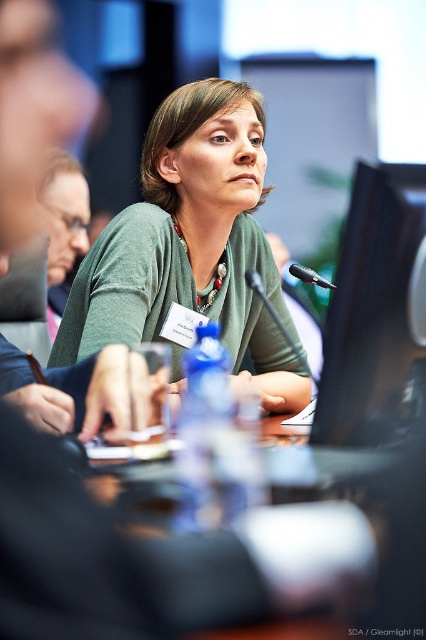
Question: Can you confirm if black glossy monitor at center is thinner than transparent glass table at center?

Choices:
 (A) yes
 (B) no

Answer: (A)

Question: Is green matte cardigan at center closer to the viewer compared to black glossy monitor at center?

Choices:
 (A) yes
 (B) no

Answer: (B)

Question: Considering the relative positions of green matte cardigan at center and transparent glass table at center in the image provided, where is green matte cardigan at center located with respect to transparent glass table at center?

Choices:
 (A) right
 (B) left

Answer: (B)

Question: Which point is closer to the camera taking this photo?

Choices:
 (A) (175, 280)
 (B) (388, 513)
 (C) (299, 273)

Answer: (B)

Question: Which point is farther from the camera taking this photo?

Choices:
 (A) (296, 275)
 (B) (351, 243)
 (C) (161, 323)

Answer: (C)

Question: Considering the real-world distances, which object is farthest from the black glossy monitor at center?

Choices:
 (A) green matte cardigan at center
 (B) black plastic microphone at center

Answer: (A)